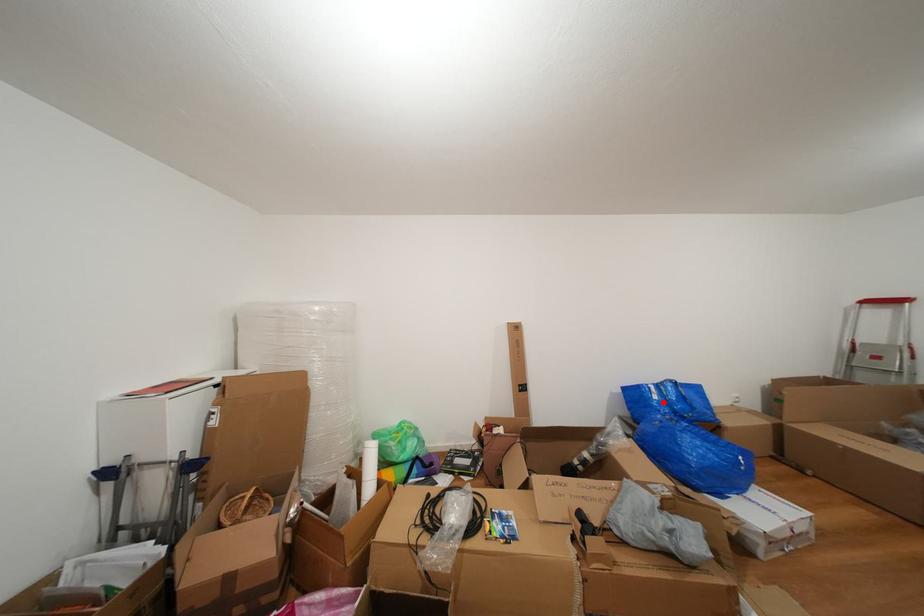
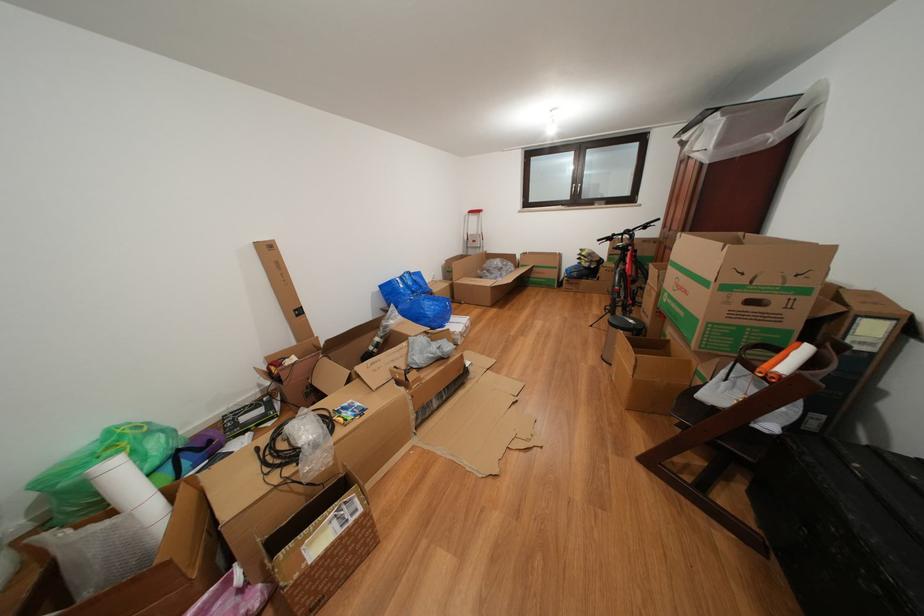
The point at the highlighted location is marked in the first image. Where is the corresponding point in the second image?

(409, 291)